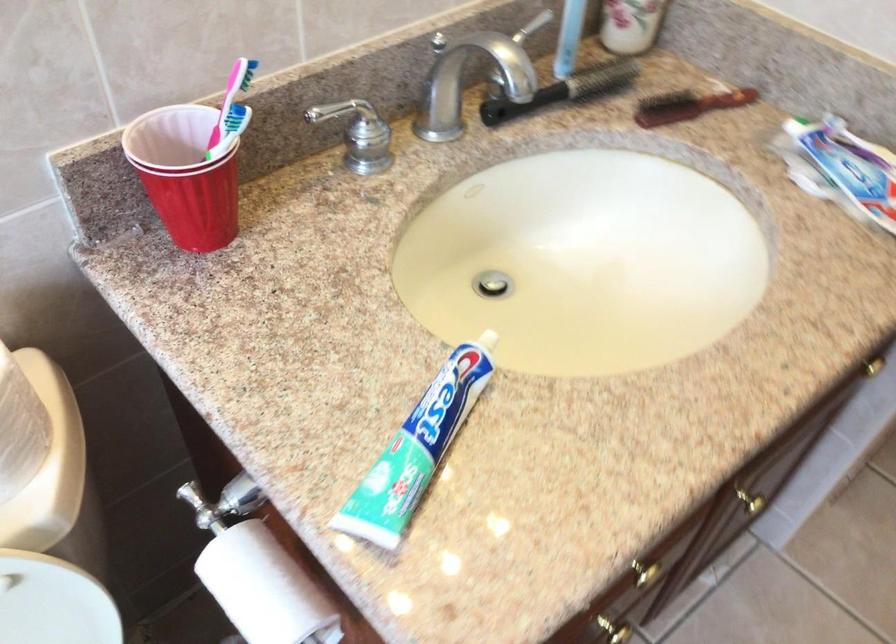
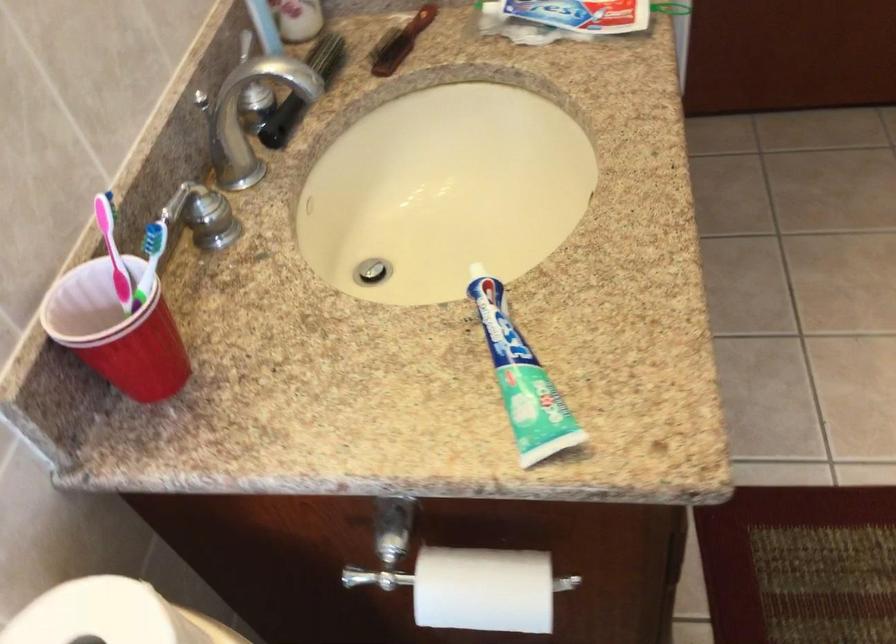
Find the pixel in the second image that matches (x=405, y=458) in the first image.

(521, 379)